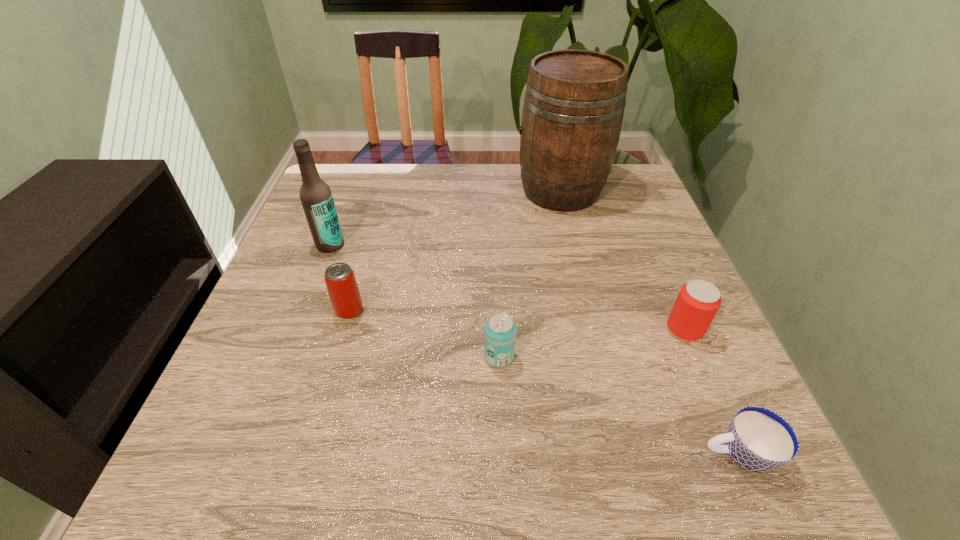
Where is `object located at the far edge`? object located at the far edge is located at coordinates (574, 103).

This screenshot has height=540, width=960. In order to click on object positioned at the near edge in this screenshot , I will do `click(758, 440)`.

This screenshot has width=960, height=540. I want to click on beer bottle at the left edge, so click(x=316, y=198).

The height and width of the screenshot is (540, 960). What are the coordinates of `beer can that is at the left edge` in the screenshot? It's located at (342, 287).

Where is `cider that is at the right edge`? This screenshot has width=960, height=540. cider that is at the right edge is located at coordinates (574, 103).

Find the location of a particular element. The image size is (960, 540). beer can present at the right edge is located at coordinates (698, 301).

The height and width of the screenshot is (540, 960). What are the coordinates of `cup that is positioned at the right edge` in the screenshot? It's located at (758, 440).

At what (x,y) coordinates should I click in order to perform the action: click on object present at the far right corner. Please return your answer as a coordinate pair (x, y). Looking at the image, I should click on (574, 103).

The width and height of the screenshot is (960, 540). I want to click on object at the near right corner, so [x=758, y=440].

In the image, there is a desktop. At what (x,y) coordinates should I click in order to perform the action: click on vacant region at the far edge. Please return your answer as a coordinate pair (x, y). This screenshot has width=960, height=540. Looking at the image, I should click on (492, 179).